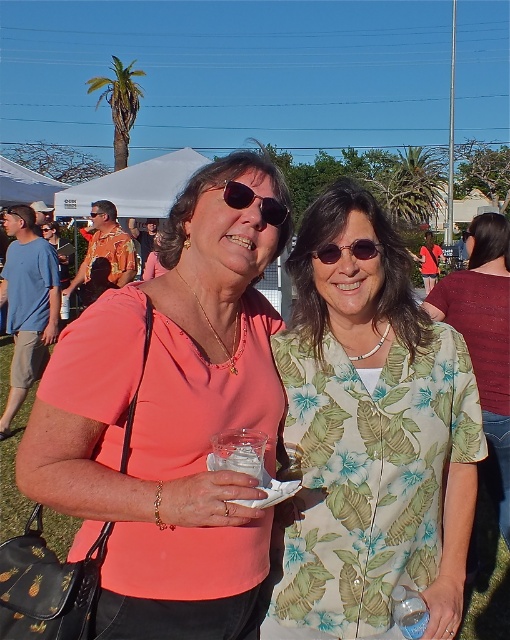
Is floral print blouse at center thinner than sunglasses at center?

No, floral print blouse at center is not thinner than sunglasses at center.

Between floral print blouse at center and sunglasses at center, which one has more height?

Standing taller between the two is floral print blouse at center.

The height and width of the screenshot is (640, 510). What are the coordinates of `floral print blouse at center` in the screenshot? It's located at (484, 340).

Does matte coral shirt at center have a greater height compared to matte black sunglasses at center?

Correct, matte coral shirt at center is much taller as matte black sunglasses at center.

Who is more distant from viewer, (208, 214) or (217, 188)?

The point (217, 188) is behind.

This screenshot has width=510, height=640. I want to click on matte coral shirt at center, so click(169, 420).

Is green leaf-patterned blouse at center further to camera compared to sunglasses at center?

No, it is in front of sunglasses at center.

How much distance is there between green leaf-patterned blouse at center and sunglasses at center?

green leaf-patterned blouse at center is 15.01 inches away from sunglasses at center.

Who is more forward, (271, 568) or (315, 253)?

Positioned in front is point (271, 568).

You are a GUI agent. You are given a task and a screenshot of the screen. Output one action in this format:
    pyautogui.click(x=<x>, y=<y>)
    Task: Click on the green leaf-patterned blouse at center
    
    Given the screenshot: What is the action you would take?
    pyautogui.click(x=370, y=436)